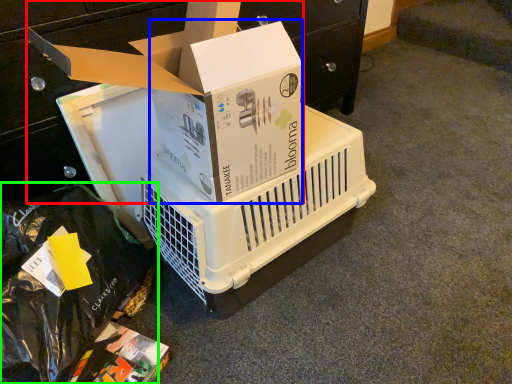
Question: Which object is the closest to the box (highlighted by a red box)? Choose among these: box (highlighted by a blue box) or garbage (highlighted by a green box).

Choices:
 (A) box
 (B) garbage

Answer: (A)